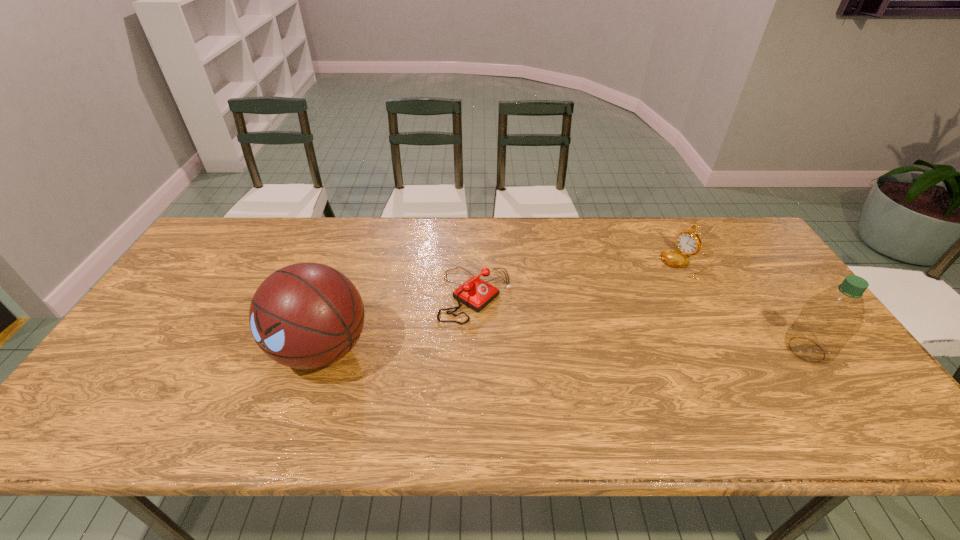
In order to click on free space on the desktop that is between the leftmost object and the rightmost object and is positioned on the dial of the telephone in this screenshot , I will do `click(567, 349)`.

Locate an element on the screen. free space on the desktop that is between the basketball and the rightmost object and is positioned on the face of the second object from right to left is located at coordinates (541, 349).